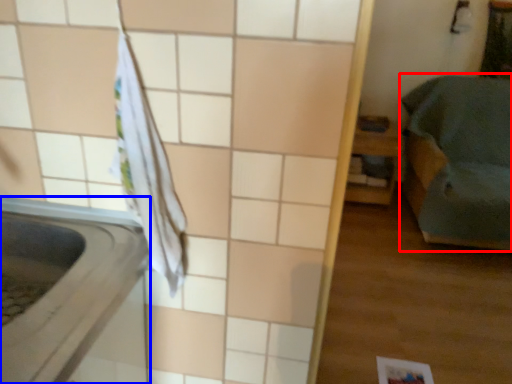
Question: Which object appears closest to the camera in this image, furniture (highlighted by a red box) or appliance (highlighted by a blue box)?

Choices:
 (A) furniture
 (B) appliance

Answer: (B)